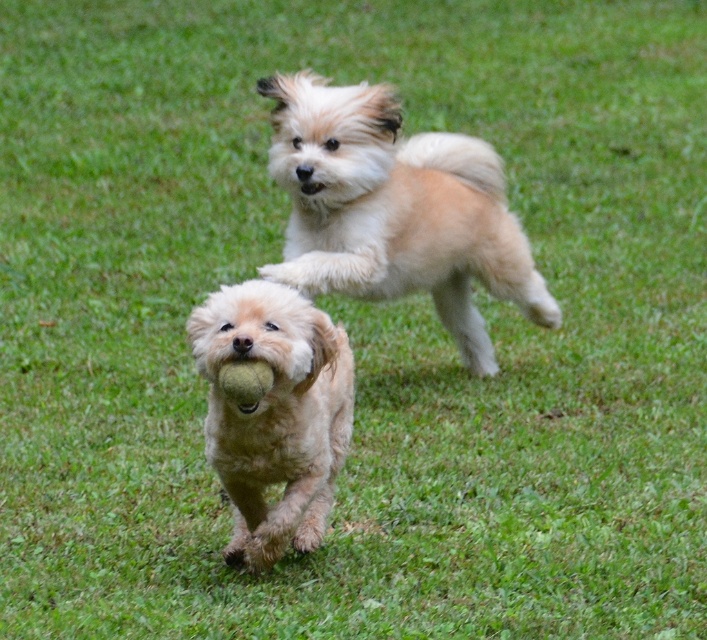
Is point (373, 92) positioned behind point (271, 397)?

Yes, point (373, 92) is farther from viewer.

Based on the photo, who is higher up, fuzzy beige dog at upper center or fuzzy beige dog at center?

fuzzy beige dog at upper center

Where is `fuzzy beige dog at upper center`? The image size is (707, 640). fuzzy beige dog at upper center is located at coordinates (395, 209).